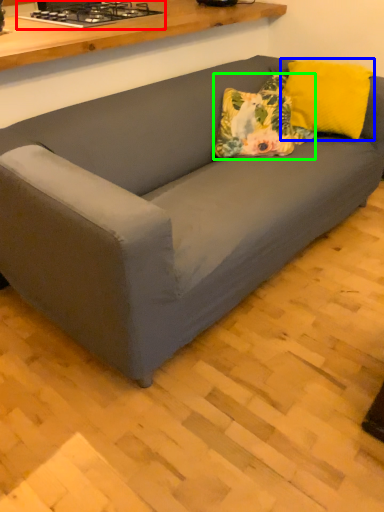
Question: Which object is the farthest from stove (highlighted by a red box)? Choose among these: pillow (highlighted by a blue box) or throw pillow (highlighted by a green box).

Choices:
 (A) pillow
 (B) throw pillow

Answer: (A)